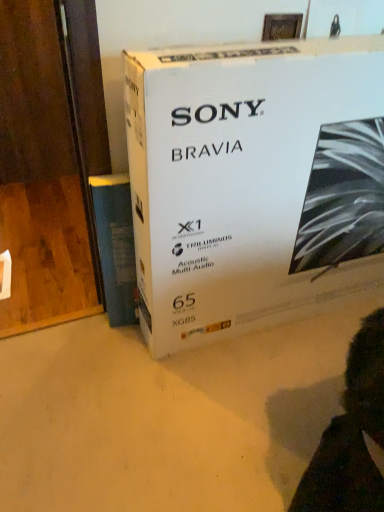
Question: From a real-world perspective, relative to white cardboard box at center, is blue paper at left vertically above or below?

Choices:
 (A) below
 (B) above

Answer: (A)

Question: Is blue paper at left wider or thinner than white cardboard box at center?

Choices:
 (A) wide
 (B) thin

Answer: (B)

Question: In the image, is blue paper at left positioned in front of or behind white cardboard box at center?

Choices:
 (A) front
 (B) behind

Answer: (B)

Question: Is white cardboard box at center in front of or behind blue paper at left in the image?

Choices:
 (A) behind
 (B) front

Answer: (B)

Question: From their relative heights in the image, would you say white cardboard box at center is taller or shorter than blue paper at left?

Choices:
 (A) tall
 (B) short

Answer: (A)

Question: Is point (185, 263) positioned closer to the camera than point (109, 185)?

Choices:
 (A) farther
 (B) closer

Answer: (B)

Question: Based on their positions, is white cardboard box at center located to the left or right of blue paper at left?

Choices:
 (A) right
 (B) left

Answer: (A)